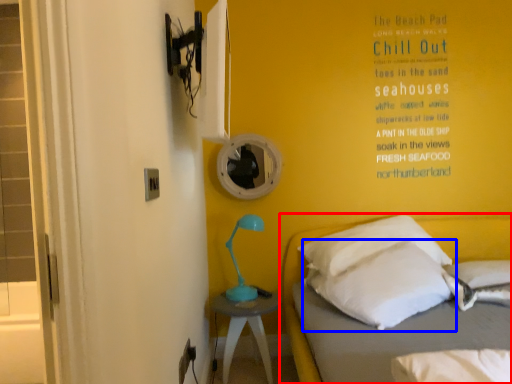
Question: Which object appears closest to the camera in this image, bed (highlighted by a red box) or pillow (highlighted by a blue box)?

Choices:
 (A) bed
 (B) pillow

Answer: (A)